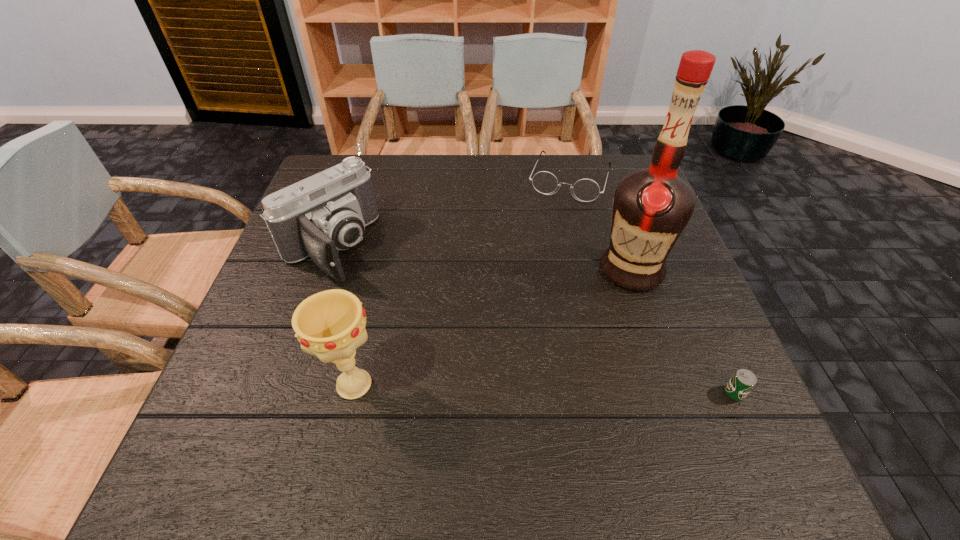
In order to click on chalice in this screenshot , I will do `click(330, 324)`.

At what (x,y) coordinates should I click in order to perform the action: click on the shortest object. Please return your answer as a coordinate pair (x, y). Looking at the image, I should click on (743, 381).

At what (x,y) coordinates should I click in order to perform the action: click on camera. Please return your answer as a coordinate pair (x, y). The height and width of the screenshot is (540, 960). Looking at the image, I should click on (326, 212).

At what (x,y) coordinates should I click in order to perform the action: click on the tallest object. Please return your answer as a coordinate pair (x, y). Looking at the image, I should click on (651, 207).

I want to click on the farthest object, so click(586, 190).

Locate an element on the screen. The height and width of the screenshot is (540, 960). the fourth tallest object is located at coordinates (586, 190).

The width and height of the screenshot is (960, 540). Identify the location of vacant space located on the back of the chalice. (372, 308).

You are a GUI agent. You are given a task and a screenshot of the screen. Output one action in this format:
    pyautogui.click(x=<x>, y=<y>)
    Task: Click on the free space located on the back of the shortest object
    Image resolution: width=960 pixels, height=540 pixels.
    Given the screenshot: What is the action you would take?
    pyautogui.click(x=685, y=284)

The height and width of the screenshot is (540, 960). Find the location of `vacant region located 0.120m at the front of the third tallest object with an open lens cover`. vacant region located 0.120m at the front of the third tallest object with an open lens cover is located at coordinates (383, 303).

The width and height of the screenshot is (960, 540). I want to click on free space located at the front of the third tallest object with an open lens cover, so click(377, 298).